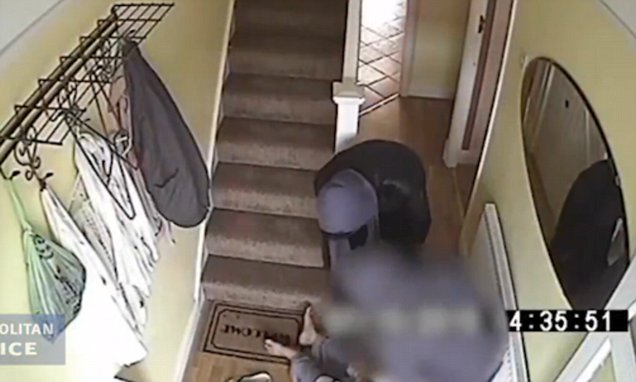
This screenshot has width=636, height=382. Find the location of `doorway`. doorway is located at coordinates (485, 2), (476, 92), (464, 145), (402, 92), (402, 28), (402, 17).